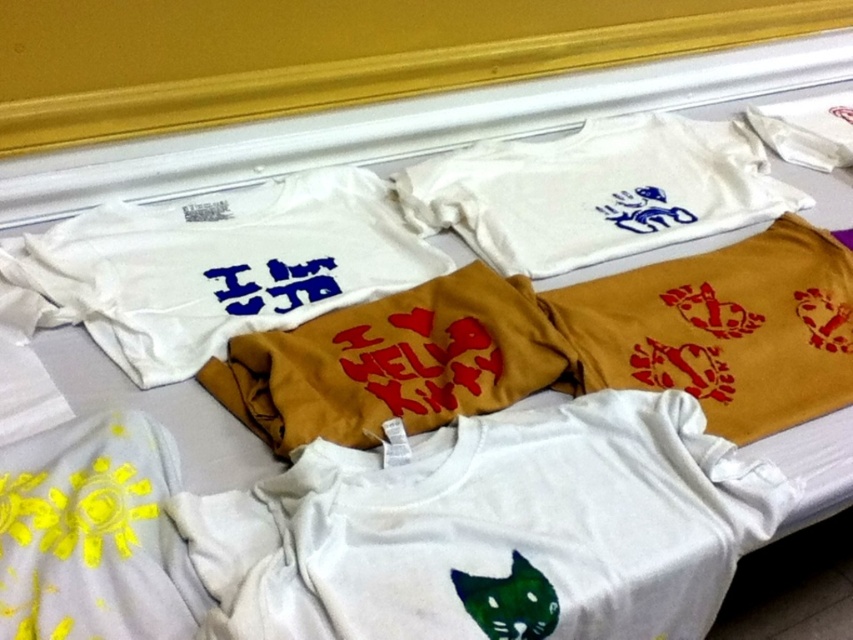
Does white cotton t-shirt at center have a smaller size compared to matte gold t-shirt at center?

Incorrect, white cotton t-shirt at center is not smaller in size than matte gold t-shirt at center.

Is white cotton t-shirt at center wider than matte gold t-shirt at center?

Indeed, white cotton t-shirt at center has a greater width compared to matte gold t-shirt at center.

Is point (701, 461) positioned behind point (285, 336)?

That is False.

Where is `white cotton t-shirt at center`? The width and height of the screenshot is (853, 640). white cotton t-shirt at center is located at coordinates (492, 531).

How far apart are orange matte t-shirt at center and yellow fabric pillow at lower left?

orange matte t-shirt at center is 23.00 inches from yellow fabric pillow at lower left.

Which of these two, orange matte t-shirt at center or yellow fabric pillow at lower left, stands taller?

Standing taller between the two is orange matte t-shirt at center.

Describe the element at coordinates (722, 328) in the screenshot. I see `orange matte t-shirt at center` at that location.

Where is `orange matte t-shirt at center`? This screenshot has width=853, height=640. orange matte t-shirt at center is located at coordinates (722, 328).

Does point (281, 621) come closer to viewer compared to point (753, 316)?

Yes, it is in front of point (753, 316).

This screenshot has height=640, width=853. What do you see at coordinates (492, 531) in the screenshot?
I see `white cotton t-shirt at center` at bounding box center [492, 531].

Identify the location of white cotton t-shirt at center. The height and width of the screenshot is (640, 853). (492, 531).